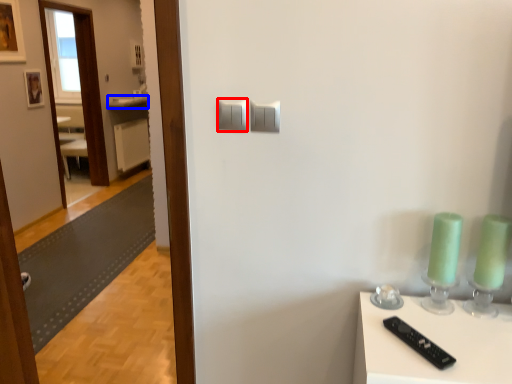
Question: Which object appears closest to the camera in this image, light switch (highlighted by a red box) or counter top (highlighted by a blue box)?

Choices:
 (A) light switch
 (B) counter top

Answer: (A)